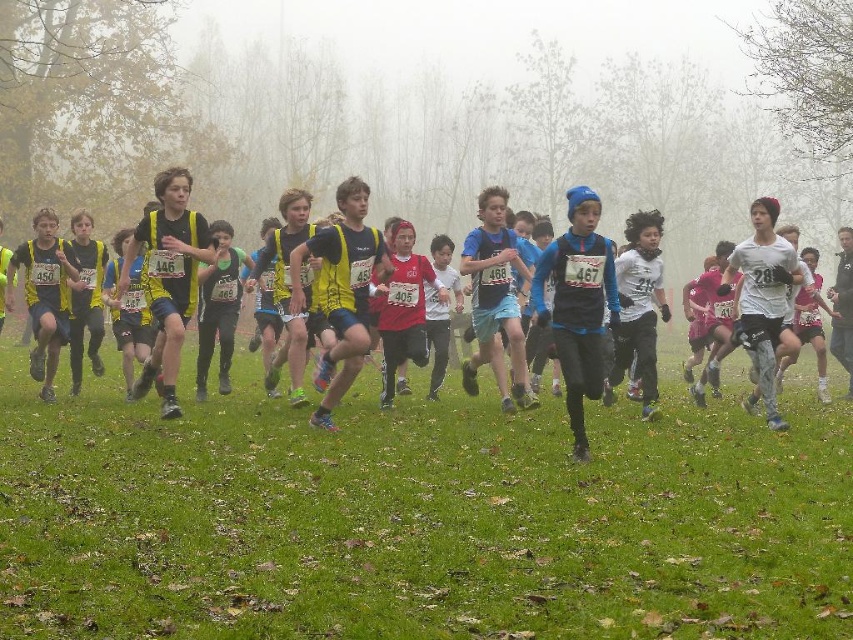
Is the position of white matte shirt at center more distant than that of yellow fabric vest at center?

Yes, it is behind yellow fabric vest at center.

You are a GUI agent. You are given a task and a screenshot of the screen. Output one action in this format:
    pyautogui.click(x=<x>, y=<y>)
    Task: Click on the white matte shirt at center
    Image resolution: width=853 pixels, height=640 pixels.
    Given the screenshot: What is the action you would take?
    pyautogui.click(x=637, y=307)

Where is `white matte shirt at center`? The height and width of the screenshot is (640, 853). white matte shirt at center is located at coordinates (637, 307).